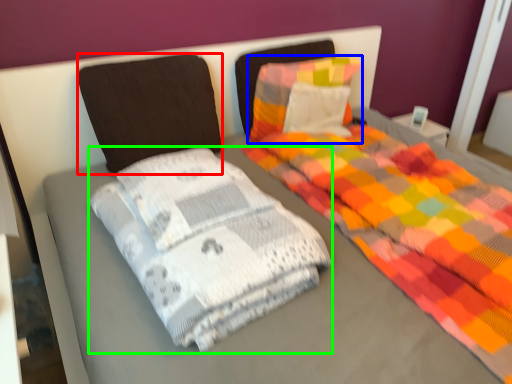
Question: Which object is the closest to the pillow (highlighted by a red box)? Choose among these: pillow (highlighted by a blue box) or material (highlighted by a green box).

Choices:
 (A) pillow
 (B) material

Answer: (A)